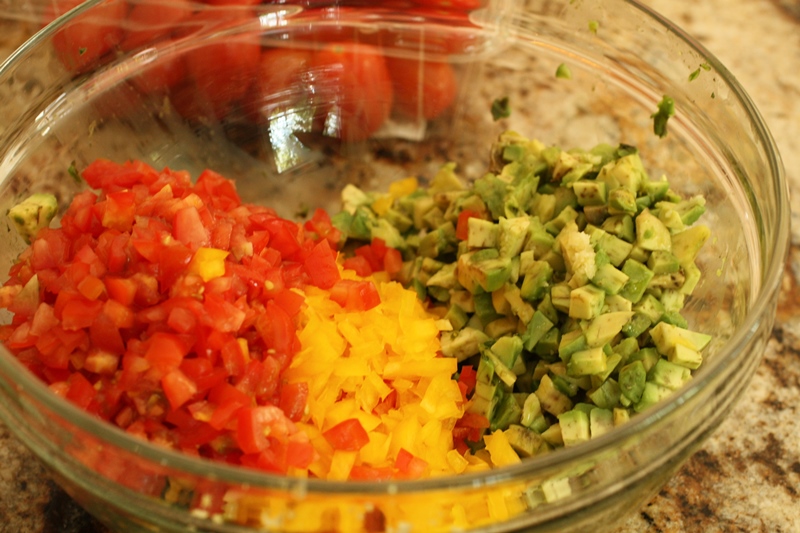
I want to click on plastic container, so click(x=14, y=2).